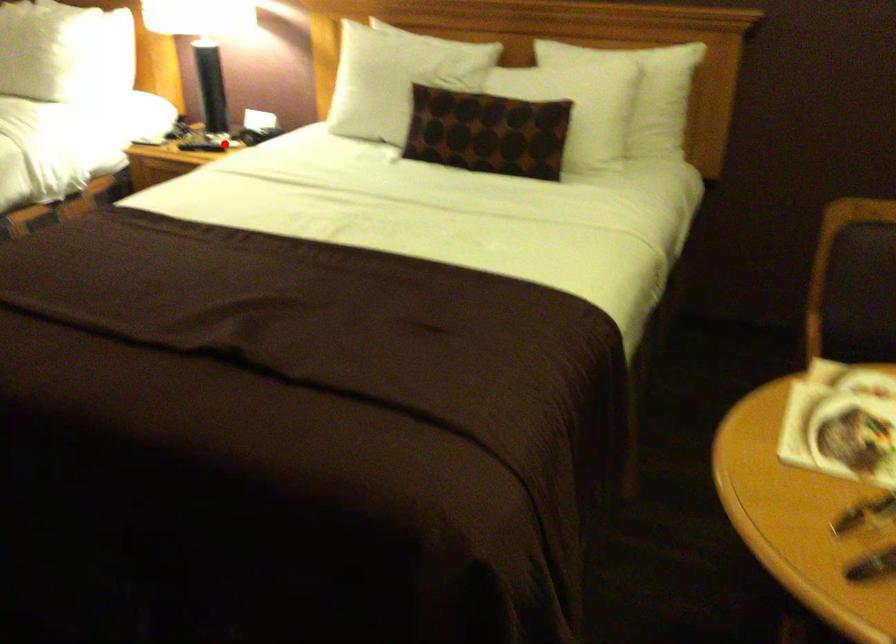
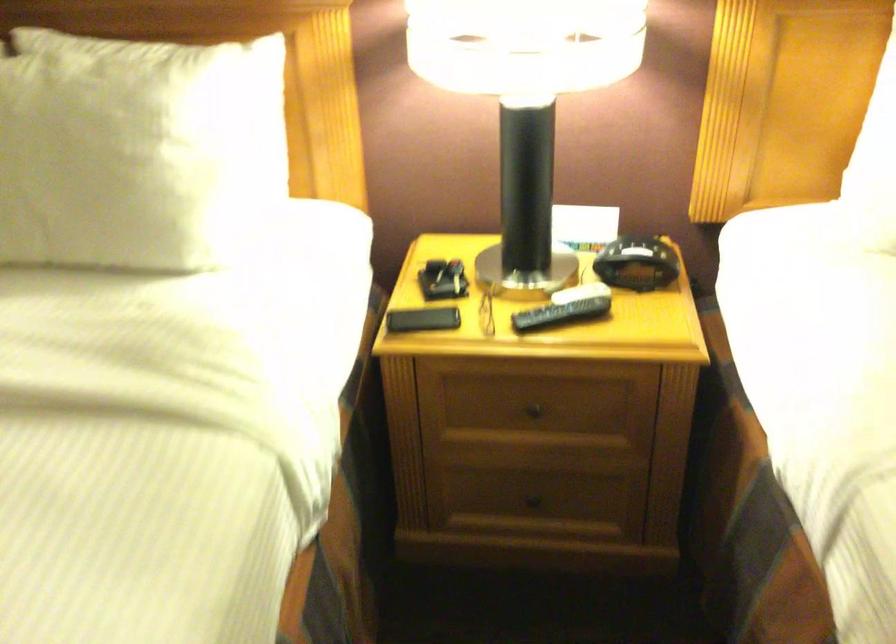
Question: I am providing you with two images of the same scene from different viewpoints. A red point is shown in image1. For the corresponding object point in image2, is it positioned nearer or farther from the camera?

Choices:
 (A) Nearer
 (B) Farther

Answer: (A)